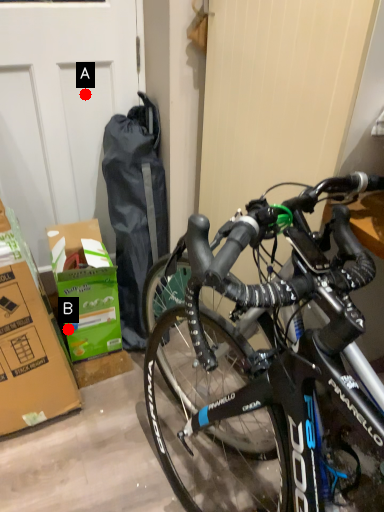
Question: Two points are circled on the image, labeled by A and B beside each circle. Which point is farther from the camera taking this photo?

Choices:
 (A) A is further
 (B) B is further

Answer: (B)